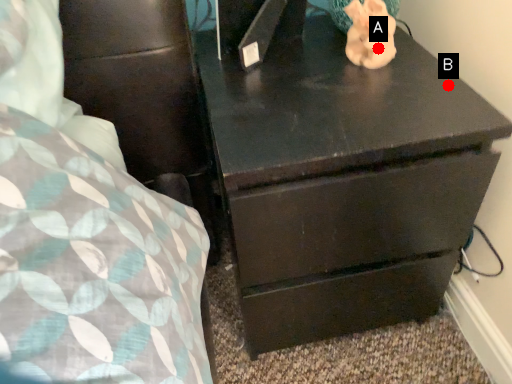
Question: Two points are circled on the image, labeled by A and B beside each circle. Among these points, which one is farthest from the camera?

Choices:
 (A) A is further
 (B) B is further

Answer: (A)